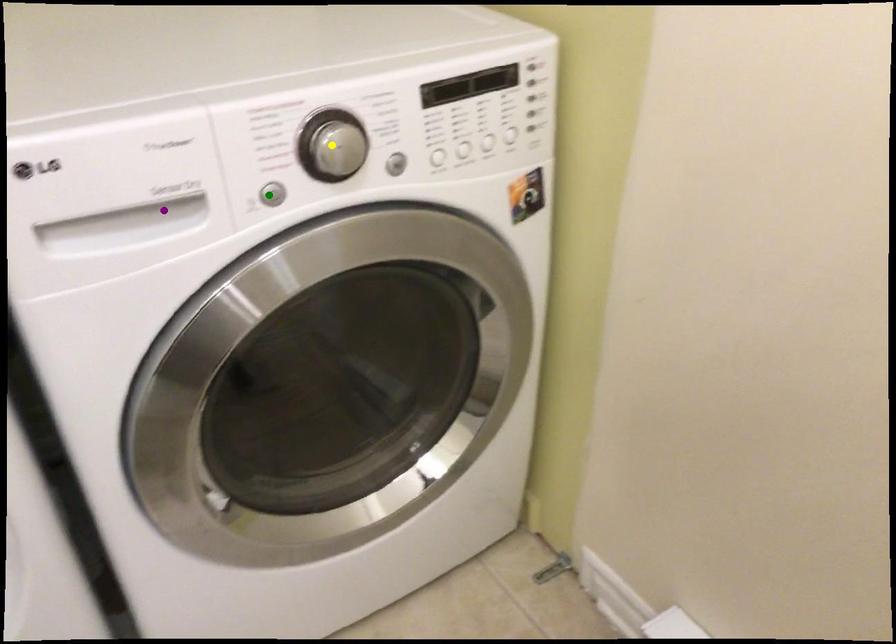
Order these from nearest to farthest:
- green point
- yellow point
- purple point

yellow point < green point < purple point